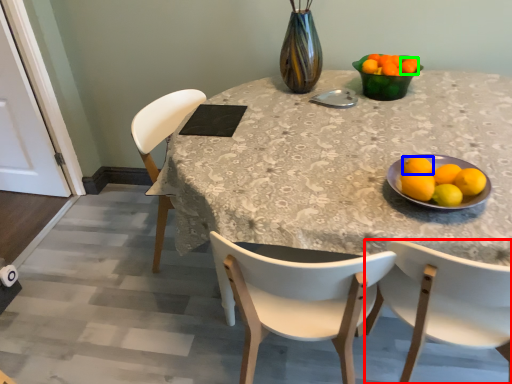
Question: Based on their relative distances, which object is farther from chair (highlighted by a red box)? Choose from lemon (highlighted by a blue box) and tangerine (highlighted by a green box).

Choices:
 (A) lemon
 (B) tangerine

Answer: (B)